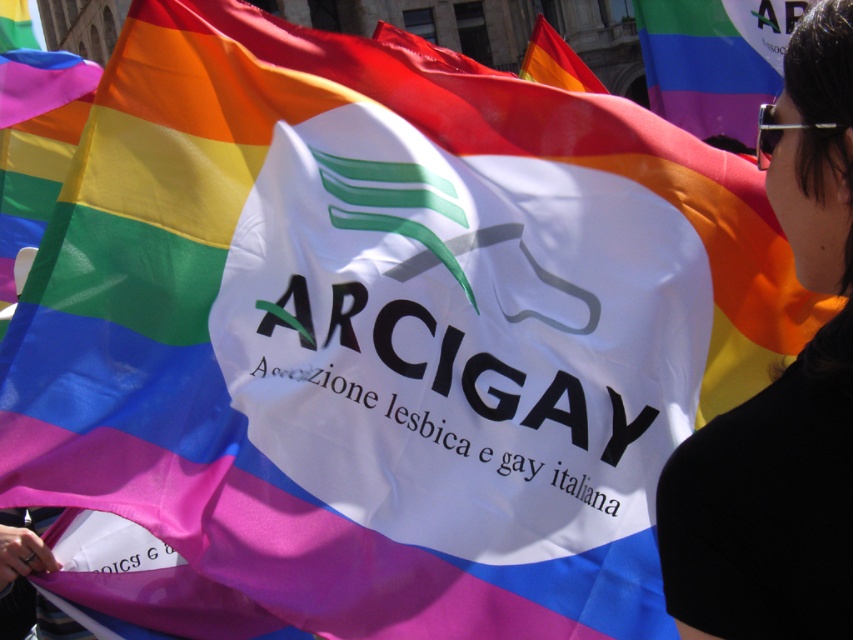
Question: Which point is farther to the camera?

Choices:
 (A) black fabric at upper right
 (B) rainbow fabric flag at upper center

Answer: (B)

Question: Which object is farther from the camera taking this photo?

Choices:
 (A) rainbow fabric flag at upper center
 (B) black fabric at upper right

Answer: (A)

Question: Is black fabric at upper right to the left of rainbow fabric flag at upper center from the viewer's perspective?

Choices:
 (A) yes
 (B) no

Answer: (B)

Question: Can you confirm if black fabric at upper right is positioned below rainbow fabric flag at upper center?

Choices:
 (A) no
 (B) yes

Answer: (B)

Question: Does black fabric at upper right have a smaller size compared to rainbow fabric flag at upper center?

Choices:
 (A) yes
 (B) no

Answer: (A)

Question: Which object appears closest to the camera in this image?

Choices:
 (A) black fabric at upper right
 (B) rainbow fabric flag at upper center

Answer: (A)